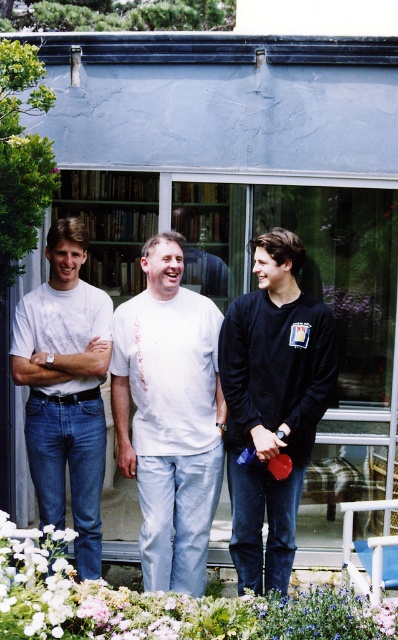
Question: Which point is farther to the camera?

Choices:
 (A) pyautogui.click(x=288, y=410)
 (B) pyautogui.click(x=152, y=557)

Answer: (B)

Question: Which is nearer to the black matte sweatshirt at center?

Choices:
 (A) wooden bookshelf at center
 (B) white matte shirt at center
 (C) white matte flower at lower center

Answer: (B)

Question: Which object is the farthest from the white matte flower at lower center?

Choices:
 (A) black matte sweatshirt at center
 (B) wooden bookshelf at center
 (C) white matte shirt at center
 (D) matte white t-shirt at left

Answer: (B)

Question: Is white matte shirt at center to the right of black matte sweatshirt at center from the viewer's perspective?

Choices:
 (A) yes
 (B) no

Answer: (B)

Question: Is white matte shirt at center thinner than black matte sweatshirt at center?

Choices:
 (A) yes
 (B) no

Answer: (B)

Question: Considering the relative positions of matte white t-shirt at left and wooden bookshelf at center in the image provided, where is matte white t-shirt at left located with respect to wooden bookshelf at center?

Choices:
 (A) right
 (B) left

Answer: (B)